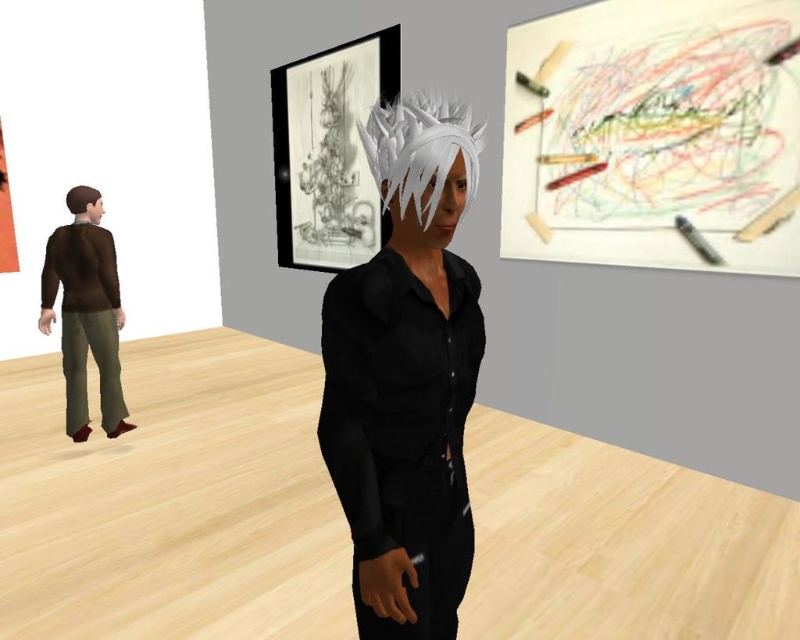
Question: Which point is closer to the camera taking this photo?

Choices:
 (A) (58, 262)
 (B) (418, 104)
 (C) (92, 202)

Answer: (B)

Question: Can you confirm if shiny black hair at center is positioned below white matte hair at center?

Choices:
 (A) yes
 (B) no

Answer: (A)

Question: Which of the following is the farthest from the observer?

Choices:
 (A) (432, 212)
 (B) (442, 552)

Answer: (B)

Question: Which of these objects is positioned closest to the brown fabric pants at left?

Choices:
 (A) shiny black hair at center
 (B) colored crayons at upper right
 (C) brown matte hair at left

Answer: (C)

Question: Is colored crayons at upper right closer to the viewer compared to shiny black hair at center?

Choices:
 (A) yes
 (B) no

Answer: (B)

Question: Is shiny black hair at center thinner than white matte hair at center?

Choices:
 (A) no
 (B) yes

Answer: (A)